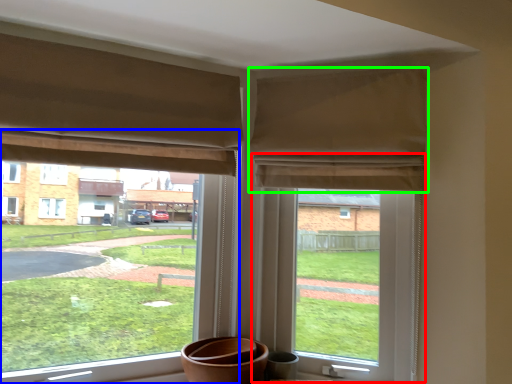
Question: Based on their relative distances, which object is farther from window screen (highlighted by a red box)? Choose from window (highlighted by a blue box) and curtain (highlighted by a green box).

Choices:
 (A) window
 (B) curtain

Answer: (A)